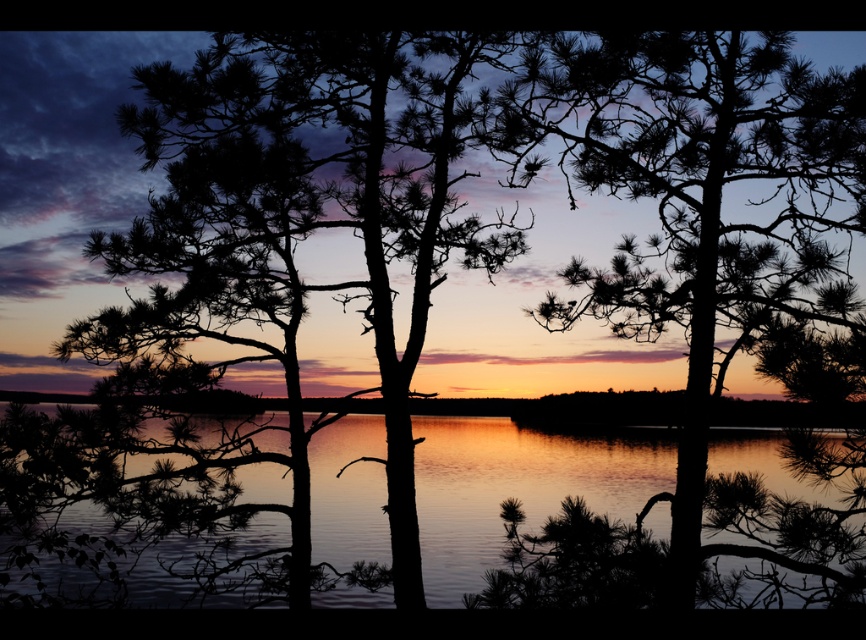
Question: Does reflective water at center appear on the right side of silhouette pine tree at center?

Choices:
 (A) no
 (B) yes

Answer: (A)

Question: Observing the image, what is the correct spatial positioning of reflective water at center in reference to silhouette pine tree at center?

Choices:
 (A) below
 (B) above

Answer: (A)

Question: From the image, what is the correct spatial relationship of reflective water at center in relation to silhouette pine tree at center?

Choices:
 (A) above
 (B) below

Answer: (B)